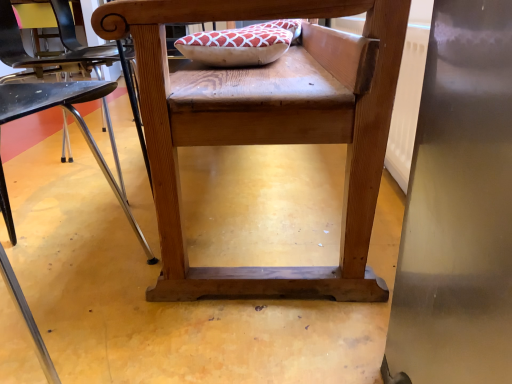
At what (x,y) coordinates should I click in order to perform the action: click on free point behind wooden chair at center, the 2th chair in the right-to-left sequence. Please return your answer as a coordinate pair (x, y). The height and width of the screenshot is (384, 512). Looking at the image, I should click on (126, 221).